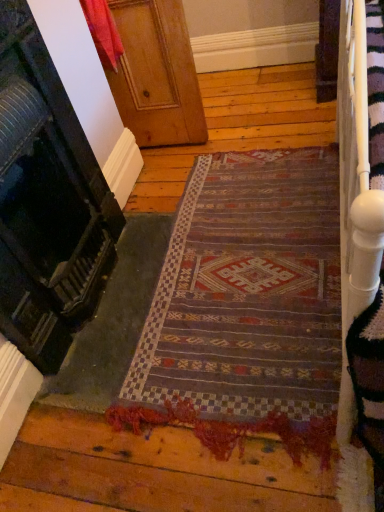
The image size is (384, 512). What do you see at coordinates (156, 74) in the screenshot?
I see `wooden at left, which is the second door in bottom-to-top order` at bounding box center [156, 74].

Where is `wooden at left, which is the second door in bottom-to-top order`? wooden at left, which is the second door in bottom-to-top order is located at coordinates (156, 74).

Is wooden door at upper center, the second door viewed from the top, at the back of textured woolen mat at center?

Answer: That's not correct — textured woolen mat at center is not looking away from wooden door at upper center, the second door viewed from the top.

From a real-world perspective, is textured woolen mat at center on wooden door at upper center, the 1th door in the bottom-to-top sequence?

No, from a real-world perspective, textured woolen mat at center is not over wooden door at upper center, the 1th door in the bottom-to-top sequence

Is textured woolen mat at center smaller than wooden door at upper center, the 1th door in the bottom-to-top sequence?

Indeed, textured woolen mat at center has a smaller size compared to wooden door at upper center, the 1th door in the bottom-to-top sequence.

What's the angular difference between textured woolen mat at center and wooden door at upper center, the second door viewed from the top,'s facing directions?

The angular difference between textured woolen mat at center and wooden door at upper center, the second door viewed from the top, is 0.773 degrees.

Which object is positioned more to the left, textured woolen mat at center or wooden at left, which is the second door in bottom-to-top order?

wooden at left, which is the second door in bottom-to-top order.

Can we say textured woolen mat at center lies outside wooden at left, which is the second door in bottom-to-top order?

Yes, textured woolen mat at center is outside of wooden at left, which is the second door in bottom-to-top order.

From a real-world perspective, who is located lower, textured woolen mat at center or wooden at left, which is the second door in bottom-to-top order?

textured woolen mat at center, from a real-world perspective.

Is textured woolen mat at center oriented away from wooden at left, which is the second door in bottom-to-top order?

textured woolen mat at center is not turned away from wooden at left, which is the second door in bottom-to-top order.

Is wooden at left, which is the second door in bottom-to-top order, bigger or smaller than wooden door at upper center, the 1th door in the bottom-to-top sequence?

In the image, wooden at left, which is the second door in bottom-to-top order, appears to be smaller than wooden door at upper center, the 1th door in the bottom-to-top sequence.

From the image's perspective, does wooden at left, which is the second door in bottom-to-top order, appear higher than wooden door at upper center, the 1th door in the bottom-to-top sequence?

Yes, from the image's perspective, wooden at left, which is the second door in bottom-to-top order, is over wooden door at upper center, the 1th door in the bottom-to-top sequence.

From a real-world perspective, is wooden at left, the first door positioned from the top, under wooden door at upper center, the 1th door in the bottom-to-top sequence?

Indeed, from a real-world perspective, wooden at left, the first door positioned from the top, is positioned beneath wooden door at upper center, the 1th door in the bottom-to-top sequence.

Does wooden at left, the first door positioned from the top, turn towards wooden door at upper center, the 1th door in the bottom-to-top sequence?

No, wooden at left, the first door positioned from the top, is not aimed at wooden door at upper center, the 1th door in the bottom-to-top sequence.

Could you measure the distance between wooden door at upper center, the 1th door in the bottom-to-top sequence, and textured woolen mat at center?

wooden door at upper center, the 1th door in the bottom-to-top sequence, is 21.37 inches from textured woolen mat at center.

Find the location of a particular element. Image resolution: width=384 pixels, height=512 pixels. mat that is below the wooden door at upper center, the second door viewed from the top (from the image's perspective) is located at coordinates (248, 291).

Is the depth of wooden door at upper center, the 1th door in the bottom-to-top sequence, less than that of textured woolen mat at center?

That is True.

Considering the relative sizes of wooden door at upper center, the 1th door in the bottom-to-top sequence, and textured woolen mat at center in the image provided, is wooden door at upper center, the 1th door in the bottom-to-top sequence, thinner than textured woolen mat at center?

Yes, wooden door at upper center, the 1th door in the bottom-to-top sequence, is thinner than textured woolen mat at center.

Considering the relative positions of wooden at left, the first door positioned from the top, and textured woolen mat at center in the image provided, is wooden at left, the first door positioned from the top, to the left of textured woolen mat at center from the viewer's perspective?

Correct, you'll find wooden at left, the first door positioned from the top, to the left of textured woolen mat at center.

Is wooden at left, which is the second door in bottom-to-top order, completely or partially outside of textured woolen mat at center?

Yes, wooden at left, which is the second door in bottom-to-top order, is not within textured woolen mat at center.

Considering the positions of point (106, 73) and point (259, 221), is point (106, 73) closer or farther from the camera than point (259, 221)?

Point (106, 73) is positioned farther from the camera compared to point (259, 221).

Who is smaller, wooden at left, the first door positioned from the top, or textured woolen mat at center?

Smaller between the two is textured woolen mat at center.

Consider the image. Is wooden door at upper center, the second door viewed from the top, positioned far away from wooden at left, which is the second door in bottom-to-top order?

No.

From the image's perspective, between wooden door at upper center, the 1th door in the bottom-to-top sequence, and wooden at left, the first door positioned from the top, who is located below?

wooden door at upper center, the 1th door in the bottom-to-top sequence, from the image's perspective.

How many degrees apart are the facing directions of wooden door at upper center, the 1th door in the bottom-to-top sequence, and wooden at left, which is the second door in bottom-to-top order?

The angular difference between wooden door at upper center, the 1th door in the bottom-to-top sequence, and wooden at left, which is the second door in bottom-to-top order, is 86.9 degrees.

Considering the points (91, 153) and (129, 95), which point is in front, point (91, 153) or point (129, 95)?

The point (91, 153) is closer to the camera.

From the image's perspective, which door is the 1st one above the textured woolen mat at center? Please provide its 2D coordinates.

[(46, 201)]

At what (x,y) coordinates should I click in order to perform the action: click on mat on the right of the wooden at left, which is the second door in bottom-to-top order. Please return your answer as a coordinate pair (x, y). The image size is (384, 512). Looking at the image, I should click on (248, 291).

Estimate the real-world distances between objects in this image. Which object is closer to wooden at left, the first door positioned from the top, textured woolen mat at center or wooden door at upper center, the second door viewed from the top?

wooden door at upper center, the second door viewed from the top, is positioned closer to the anchor wooden at left, the first door positioned from the top.

From the image, which object appears to be farther from textured woolen mat at center, wooden door at upper center, the second door viewed from the top, or wooden at left, the first door positioned from the top?

wooden at left, the first door positioned from the top.

Which object lies nearer to the anchor point wooden at left, which is the second door in bottom-to-top order, wooden door at upper center, the second door viewed from the top, or textured woolen mat at center?

Based on the image, wooden door at upper center, the second door viewed from the top, appears to be nearer to wooden at left, which is the second door in bottom-to-top order.

Based on the photo, considering their positions, is wooden at left, which is the second door in bottom-to-top order, positioned closer to wooden door at upper center, the 1th door in the bottom-to-top sequence, than textured woolen mat at center?

The object closer to wooden door at upper center, the 1th door in the bottom-to-top sequence, is textured woolen mat at center.

Based on their spatial positions, is wooden at left, the first door positioned from the top, or wooden door at upper center, the second door viewed from the top, further from textured woolen mat at center?

The object further to textured woolen mat at center is wooden at left, the first door positioned from the top.

From the picture: When comparing their distances from wooden door at upper center, the 1th door in the bottom-to-top sequence, does textured woolen mat at center or wooden at left, which is the second door in bottom-to-top order, seem further?

wooden at left, which is the second door in bottom-to-top order.

Where is `door that lies between wooden at left, which is the second door in bottom-to-top order, and textured woolen mat at center from top to bottom`? Image resolution: width=384 pixels, height=512 pixels. door that lies between wooden at left, which is the second door in bottom-to-top order, and textured woolen mat at center from top to bottom is located at coordinates [46, 201].